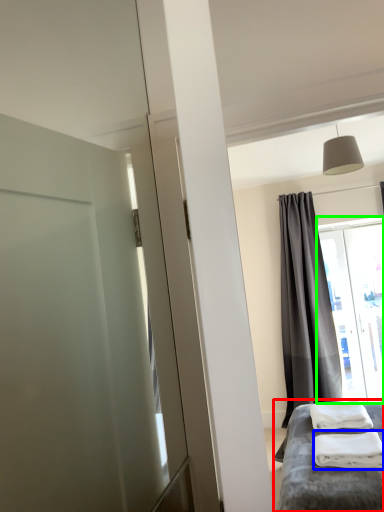
Question: Which is farther away from furniture (highlighted by a red box)? material (highlighted by a blue box) or window (highlighted by a green box)?

Choices:
 (A) material
 (B) window

Answer: (B)